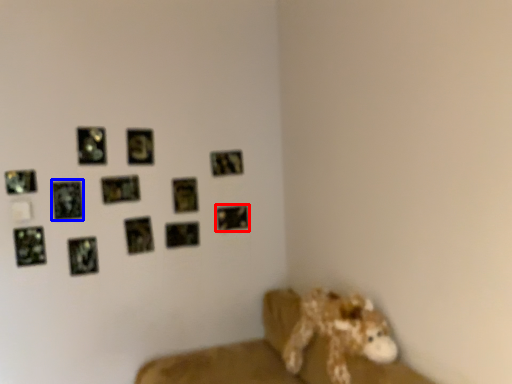
Question: Which object appears closest to the camera in this image, picture frame (highlighted by a red box) or picture frame (highlighted by a blue box)?

Choices:
 (A) picture frame
 (B) picture frame

Answer: (B)